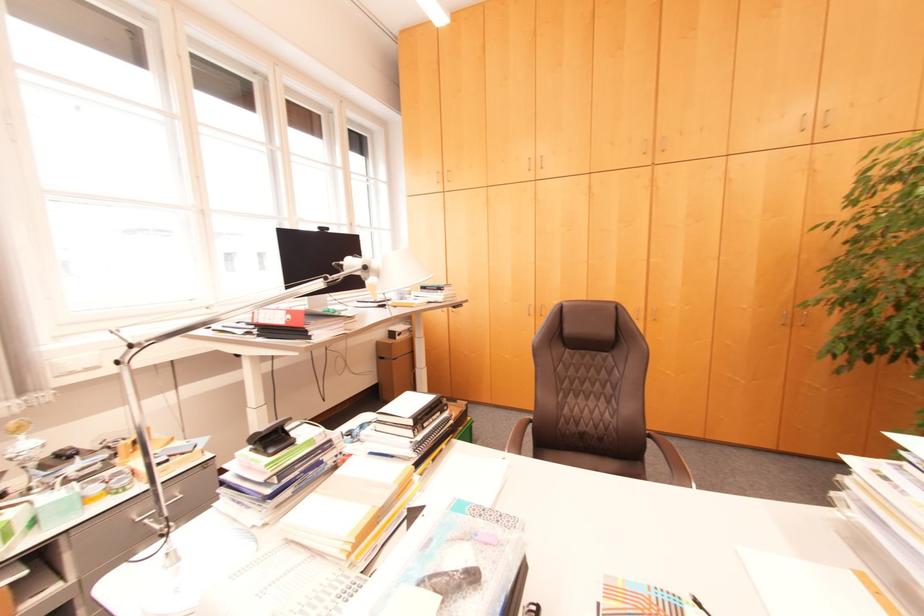
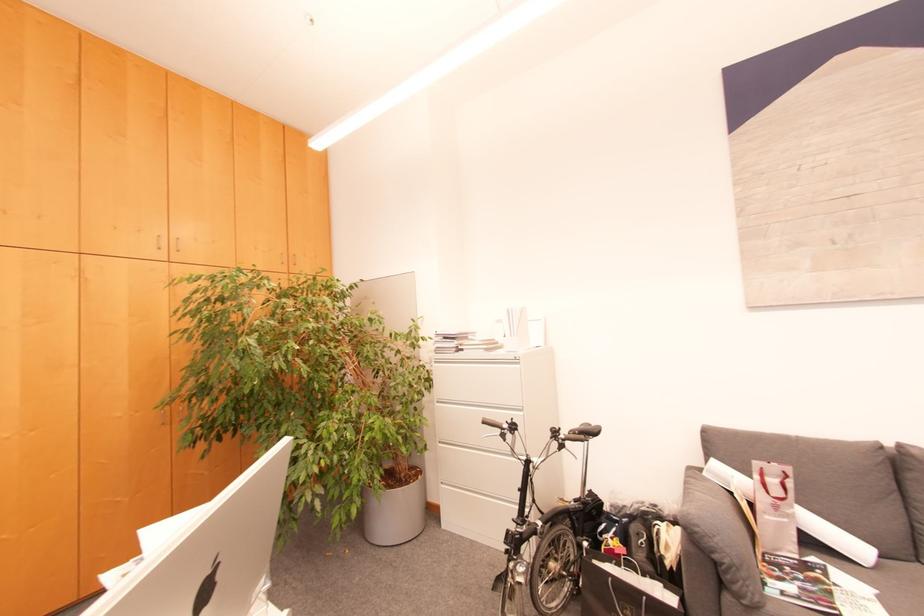
Question: How did the camera likely rotate?

Choices:
 (A) Left
 (B) Right
 (C) Up
 (D) Down

Answer: (B)